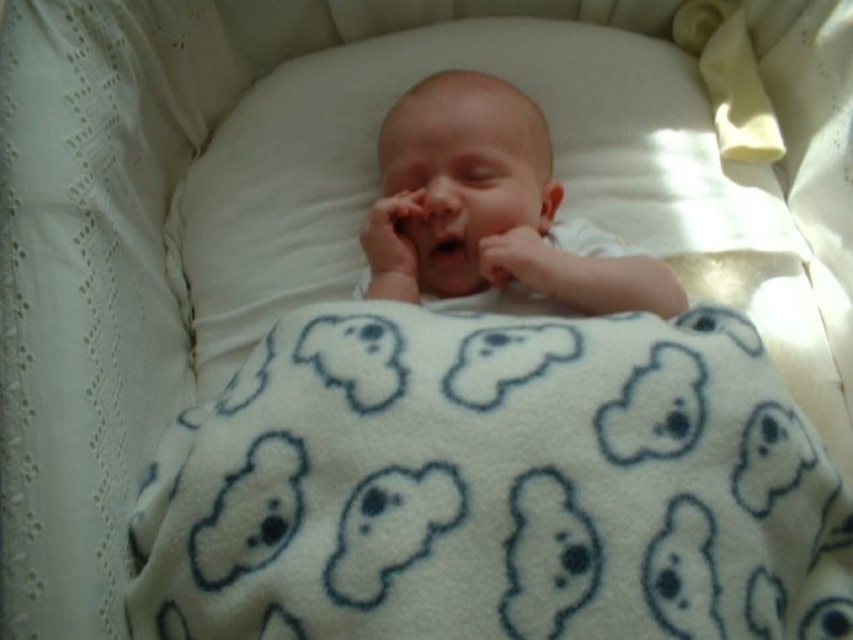
Question: Which of these objects is positioned closest to the white fleece blanket at center?

Choices:
 (A) smooth white newborn at center
 (B) white soft pillow at center

Answer: (A)

Question: Does white fleece blanket at center have a lesser width compared to smooth white newborn at center?

Choices:
 (A) no
 (B) yes

Answer: (A)

Question: Is white fleece blanket at center further to the viewer compared to smooth white newborn at center?

Choices:
 (A) no
 (B) yes

Answer: (A)

Question: Does white fleece blanket at center have a lesser width compared to white soft pillow at center?

Choices:
 (A) yes
 (B) no

Answer: (A)

Question: Which point is farther to the camera?

Choices:
 (A) (625, 522)
 (B) (329, 108)
 (C) (428, 218)

Answer: (B)

Question: Which point is closer to the camera taking this photo?

Choices:
 (A) pos(287,381)
 (B) pos(447,180)
 (C) pos(722,300)

Answer: (A)